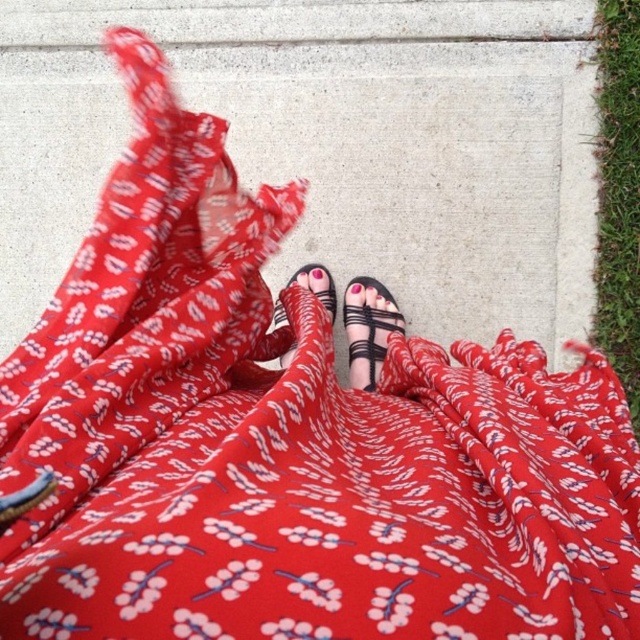
This screenshot has width=640, height=640. What are the coordinates of `black leather sandal at lower center` in the screenshot? It's located at (369, 328).

Image resolution: width=640 pixels, height=640 pixels. Find the location of `black leather sandal at lower center`. black leather sandal at lower center is located at coordinates (369, 328).

Is green grass at right taller than black leather sandal at lower center?

Correct, green grass at right is much taller as black leather sandal at lower center.

Is green grass at right smaller than black leather sandal at lower center?

No, green grass at right is not smaller than black leather sandal at lower center.

The width and height of the screenshot is (640, 640). I want to click on green grass at right, so click(x=618, y=193).

In order to click on green grass at right in this screenshot , I will do `click(618, 193)`.

Does green grass at right appear over matte black sandal at center?

Indeed, green grass at right is positioned over matte black sandal at center.

Is point (605, 132) less distant than point (278, 360)?

No.

You are a GUI agent. You are given a task and a screenshot of the screen. Output one action in this format:
    pyautogui.click(x=<x>, y=<y>)
    Task: Click on the green grass at right
    
    Given the screenshot: What is the action you would take?
    [x=618, y=193]